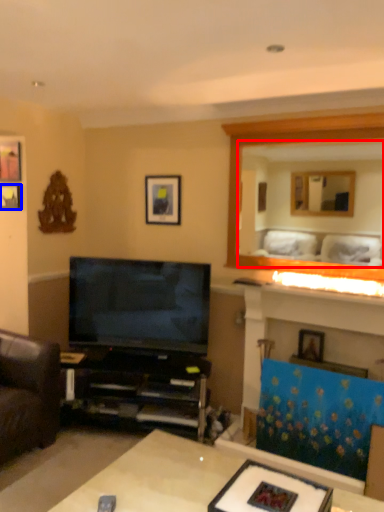
Question: Which point is further to the camera, mirror (highlighted by a red box) or picture frame (highlighted by a blue box)?

Choices:
 (A) mirror
 (B) picture frame

Answer: (B)